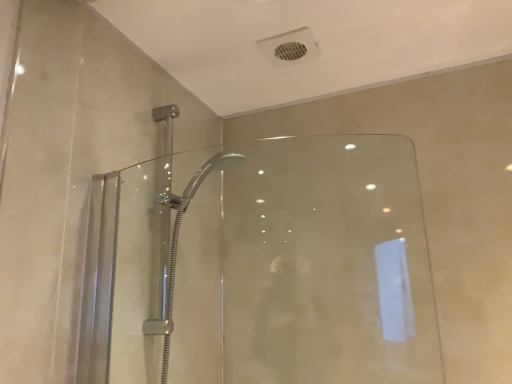
This screenshot has height=384, width=512. Describe the element at coordinates (306, 268) in the screenshot. I see `transparent glass shower door at upper center` at that location.

Locate an element on the screen. This screenshot has width=512, height=384. transparent glass shower door at upper center is located at coordinates (306, 268).

Identify the location of transparent glass shower door at upper center. (306, 268).